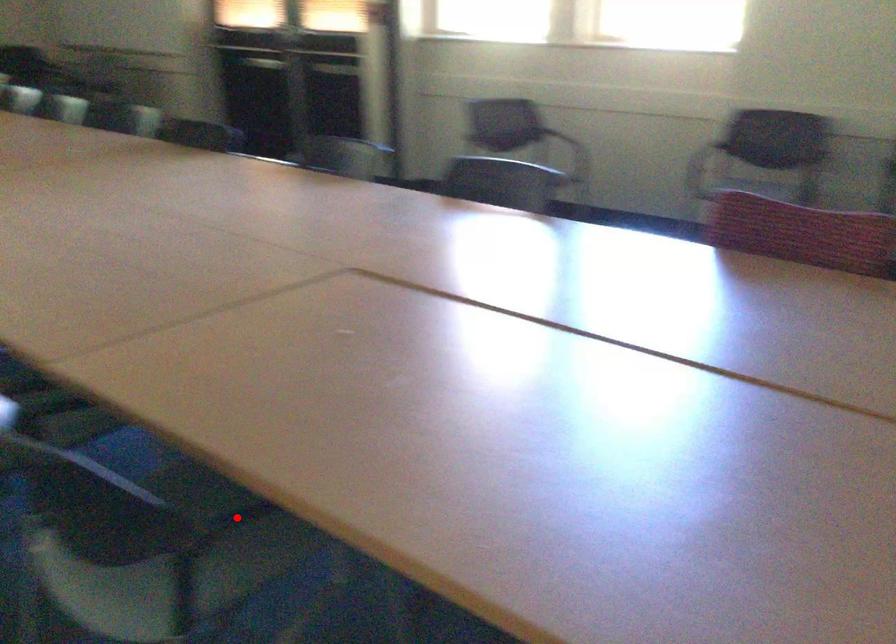
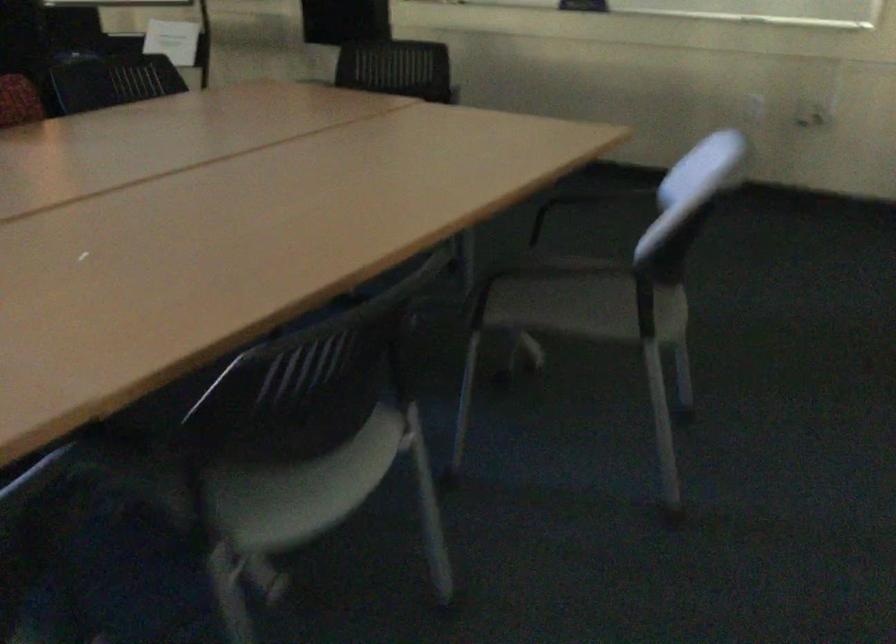
Question: I am providing you with two images of the same scene from different viewpoints. A red point is marked on the first image. At the location where the point appears in image 1, is it still visible in image 2?

Choices:
 (A) Yes
 (B) No

Answer: (B)